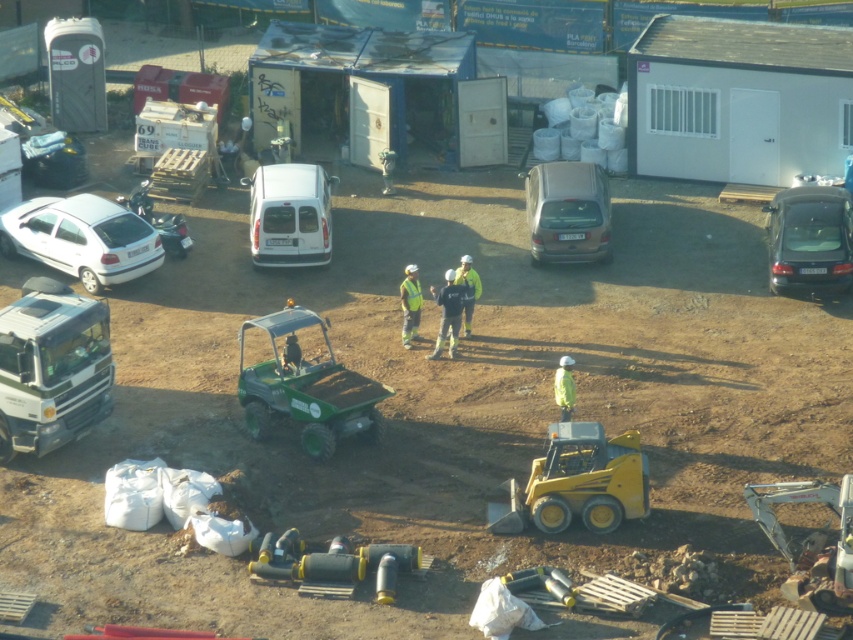
You are standing on the balcony overlooking the construction site. You see a satin gold car at center and a reflective yellow safety vest at center. Which object is closer to you?

The satin gold car at center is closer to you because it is further to the viewer than the reflective yellow safety vest at center.

You are a delivery driver who needs to park your white matte hatchback at left in a designated parking spot that can only accommodate vehicles smaller than the reflective yellow safety vest at center. Can your vehicle fit in the parking spot?

The white matte hatchback at left is larger in size than the reflective yellow safety vest at center, so it cannot fit in the parking spot designated for smaller vehicles.

You are a delivery driver who needs to park your vehicle near the satin gold car at center and the reflective yellow safety vest at center. Based on the scene, which object is on the left side when facing the scene?

The reflective yellow safety vest at center is on the left side of the satin gold car at center, so when facing the scene, the reflective yellow safety vest at center is on the left.